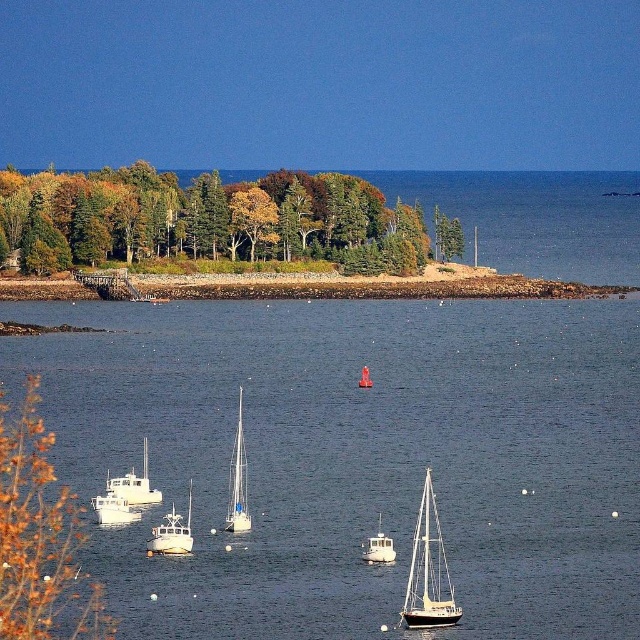
You are a photographer planning to capture the smooth stone pier at center and the white matte boat at lower center in a single frame. Given their sizes, which object should you position closer to the center of your camera frame to ensure both are clearly visible?

The smooth stone pier at center is larger in size than the white matte boat at lower center, so positioning the pier closer to the center of the camera frame will help balance the composition and ensure both are clearly visible.

You are standing at the center of the image and want to navigate towards the green leafy trees at upper left. Based on their position, in which direction should you head?

The green leafy trees at upper left are located at point coordinates, so you should head towards the upper left direction to reach them.

You are a photographer planning to capture a wide shot of the coastal scene. You want to ensure both the white glossy sailboat at lower center and the white glossy sailboat at center are fully visible in your frame. Given their sizes, which boat will appear larger in the photograph?

The white glossy sailboat at center will appear larger in the photograph because it is larger than the white glossy sailboat at lower center.